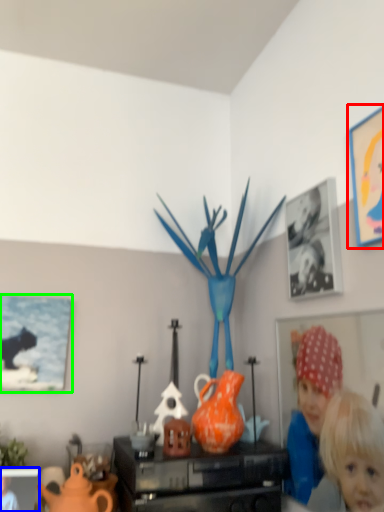
Question: Based on their relative distances, which object is farther from picture frame (highlighted by a red box)? Choose from picture frame (highlighted by a blue box) and picture frame (highlighted by a green box).

Choices:
 (A) picture frame
 (B) picture frame

Answer: (A)